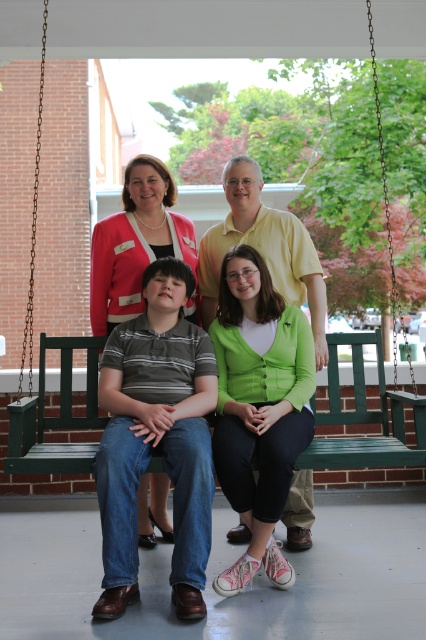
Question: Is matte striped shirt at center bigger than matte green cardigan at center?

Choices:
 (A) yes
 (B) no

Answer: (A)

Question: Can you confirm if green wooden bench at center is smaller than yellow matte shirt at upper center?

Choices:
 (A) yes
 (B) no

Answer: (A)

Question: Which point appears farthest from the camera in this image?

Choices:
 (A) (147, 348)
 (B) (310, 262)
 (C) (322, 346)

Answer: (B)

Question: Which object is positioned closest to the matte striped shirt at center?

Choices:
 (A) matte green cardigan at center
 (B) green wooden bench at center

Answer: (A)

Question: Which of the following is the farthest from the observer?

Choices:
 (A) (123, 230)
 (B) (216, 280)

Answer: (B)

Question: Is matte green cardigan at center positioned in front of yellow matte shirt at upper center?

Choices:
 (A) no
 (B) yes

Answer: (A)